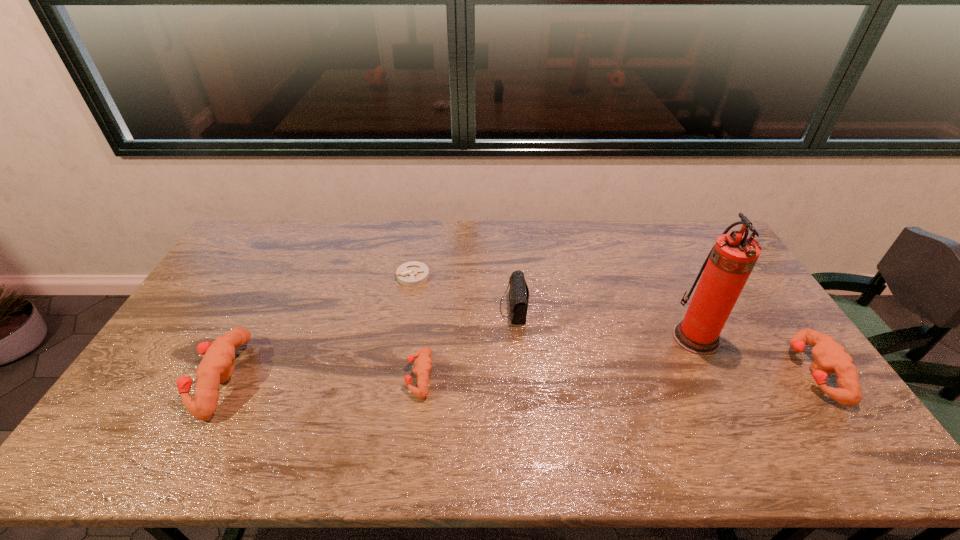
Where is `free spot between the farthest object and the leftmost puncher`? The height and width of the screenshot is (540, 960). free spot between the farthest object and the leftmost puncher is located at coordinates (317, 327).

The image size is (960, 540). Identify the location of vacant space that's between the fire extinguisher and the third object from right to left. (605, 323).

Where is `the fourth closest object to the leftmost puncher`? the fourth closest object to the leftmost puncher is located at coordinates (730, 262).

Image resolution: width=960 pixels, height=540 pixels. Find the location of `object that is the second nearest to the farthest object`. object that is the second nearest to the farthest object is located at coordinates (423, 364).

Identify the location of puncher that is the second closest to the second puncher from right to left. (830, 357).

The width and height of the screenshot is (960, 540). I want to click on puncher that can be found as the closest to the leftmost puncher, so click(x=423, y=364).